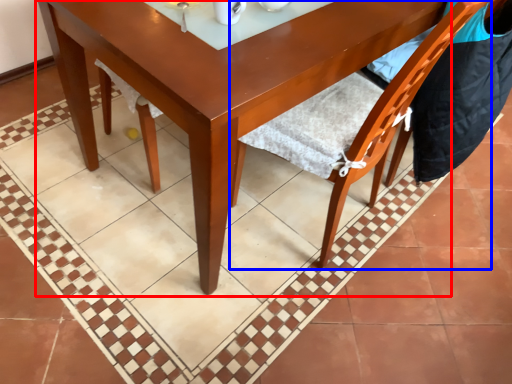
Question: Which of the following is the farthest to the observer, round table (highlighted by a red box) or chair (highlighted by a blue box)?

Choices:
 (A) round table
 (B) chair

Answer: (A)